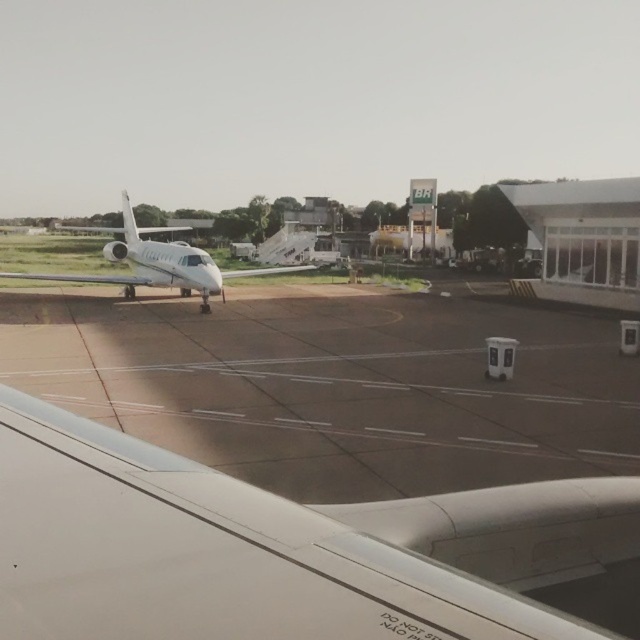
Question: Does white matte wing at upper left appear over clear glass airplane window at center?

Choices:
 (A) no
 (B) yes

Answer: (A)

Question: Is white matte wing at upper left thinner than white glossy airplane at left?

Choices:
 (A) no
 (B) yes

Answer: (B)

Question: Which point is farther from the camera taking this photo?

Choices:
 (A) (192, 257)
 (B) (224, 397)
 (C) (132, 282)
 (D) (465, 614)

Answer: (C)

Question: Considering the real-world distances, which object is closest to the white matte wing at upper left?

Choices:
 (A) white glossy airplane at left
 (B) dark gray asphalt at center

Answer: (B)

Question: Which object is positioned closest to the clear glass airplane window at center?

Choices:
 (A) white matte wing at upper left
 (B) white glossy airplane at left

Answer: (B)

Question: Is white matte wing at upper left smaller than clear glass airplane window at center?

Choices:
 (A) no
 (B) yes

Answer: (A)